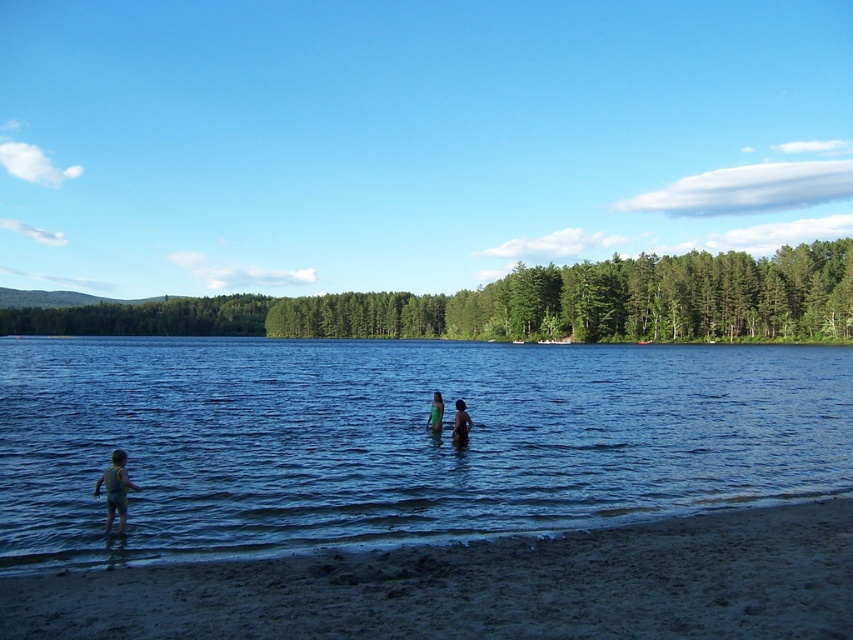
You are a photographer trying to capture the scene with the smooth skin person at center and the green fabric at center. To ensure both are in the frame, should you adjust your camera to the left or right?

The smooth skin person at center is positioned on the right side of green fabric at center, so you should adjust your camera to the left to include both in the frame.

Consider the image. You are a lifeguard standing on the beach and need to reach the green fabric at center quickly. Which direction should you move to get there faster, towards the dark sand at lower left or away from it?

The dark sand at lower left is shorter than the green fabric at center, so moving towards the dark sand at lower left would bring you closer to the green fabric at center faster.

You are standing at the point marked by the coordinates point (397,440). What is the color and type of the surface you are currently on?

The surface at point (397,440) is blue liquid water.